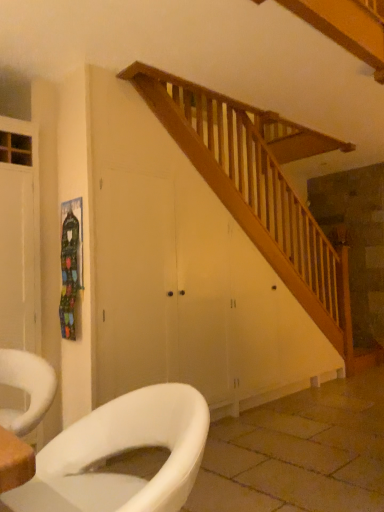
This screenshot has height=512, width=384. Describe the element at coordinates (119, 452) in the screenshot. I see `white glossy toilet at lower left` at that location.

Identify the location of white glossy toilet at lower left. Image resolution: width=384 pixels, height=512 pixels. (119, 452).

The image size is (384, 512). What do you see at coordinates (299, 453) in the screenshot?
I see `white glossy toilet at lower left` at bounding box center [299, 453].

The height and width of the screenshot is (512, 384). Identify the location of white glossy toilet at lower left. (299, 453).

I want to click on white glossy toilet at lower left, so click(119, 452).

Which is more to the right, white glossy toilet at lower left or white glossy toilet at lower left?

white glossy toilet at lower left.

In the image, is white glossy toilet at lower left positioned in front of or behind white glossy toilet at lower left?

In the image, white glossy toilet at lower left appears in front of white glossy toilet at lower left.

Which is nearer, (26, 484) or (211, 450)?

The point (26, 484) is closer to the camera.

From the image's perspective, is white glossy toilet at lower left on white glossy toilet at lower left?

Correct, white glossy toilet at lower left appears higher than white glossy toilet at lower left in the image.

From a real-world perspective, is white glossy toilet at lower left above or below white glossy toilet at lower left?

From a real-world perspective, white glossy toilet at lower left is physically above white glossy toilet at lower left.

Which of these two, white glossy toilet at lower left or white glossy toilet at lower left, is wider?

white glossy toilet at lower left is wider.

From the picture: In terms of height, does white glossy toilet at lower left look taller or shorter compared to white glossy toilet at lower left?

white glossy toilet at lower left is taller than white glossy toilet at lower left.

In terms of size, does white glossy toilet at lower left appear bigger or smaller than white glossy toilet at lower left?

Clearly, white glossy toilet at lower left is smaller in size than white glossy toilet at lower left.

Do you think white glossy toilet at lower left is within white glossy toilet at lower left, or outside of it?

white glossy toilet at lower left is not enclosed by white glossy toilet at lower left.

In the scene shown: Is white glossy toilet at lower left beside white glossy toilet at lower left?

No, white glossy toilet at lower left is not in contact with white glossy toilet at lower left.

Does white glossy toilet at lower left turn towards white glossy toilet at lower left?

No.

Measure the distance between white glossy toilet at lower left and white glossy toilet at lower left.

6.27 feet.

Locate an element on the screen. This screenshot has height=512, width=384. tile behind the white glossy toilet at lower left is located at coordinates (299, 453).

Between white glossy toilet at lower left and white glossy toilet at lower left, which one appears on the left side from the viewer's perspective?

white glossy toilet at lower left.

Who is more distant, white glossy toilet at lower left or white glossy toilet at lower left?

white glossy toilet at lower left is behind.

Is point (307, 481) closer or farther from the camera than point (138, 488)?

Point (307, 481) is positioned farther from the camera compared to point (138, 488).

From the image's perspective, between white glossy toilet at lower left and white glossy toilet at lower left, who is located below?

white glossy toilet at lower left.

From a real-world perspective, which is physically below, white glossy toilet at lower left or white glossy toilet at lower left?

white glossy toilet at lower left.

Considering the sizes of objects white glossy toilet at lower left and white glossy toilet at lower left in the image provided, who is thinner, white glossy toilet at lower left or white glossy toilet at lower left?

white glossy toilet at lower left.

Considering the sizes of white glossy toilet at lower left and white glossy toilet at lower left in the image, is white glossy toilet at lower left taller or shorter than white glossy toilet at lower left?

white glossy toilet at lower left is shorter than white glossy toilet at lower left.

Is white glossy toilet at lower left smaller than white glossy toilet at lower left?

Actually, white glossy toilet at lower left might be larger than white glossy toilet at lower left.

Is white glossy toilet at lower left a part of white glossy toilet at lower left?

Actually, white glossy toilet at lower left is outside white glossy toilet at lower left.

Is white glossy toilet at lower left not near white glossy toilet at lower left?

Yes, white glossy toilet at lower left is far from white glossy toilet at lower left.

Is white glossy toilet at lower left aimed at white glossy toilet at lower left?

No, white glossy toilet at lower left is not turned towards white glossy toilet at lower left.

Can you tell me how much white glossy toilet at lower left and white glossy toilet at lower left differ in facing direction?

174 degrees.

How distant is white glossy toilet at lower left from white glossy toilet at lower left?

A distance of 1.91 meters exists between white glossy toilet at lower left and white glossy toilet at lower left.

Locate an element on the screen. tile below the white glossy toilet at lower left (from the image's perspective) is located at coordinates (299, 453).

Find the location of a particular element. This screenshot has height=512, width=384. toilet above the white glossy toilet at lower left (from the image's perspective) is located at coordinates (119, 452).

Identify the location of tile on the right side of white glossy toilet at lower left. (299, 453).